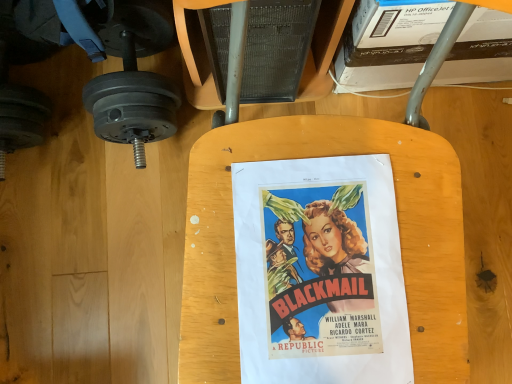
Question: Is vibrant paper poster at center next to matte black dumbbell at left?

Choices:
 (A) yes
 (B) no

Answer: (B)

Question: Considering the relative sizes of vibrant paper poster at center and matte black dumbbell at left in the image provided, is vibrant paper poster at center bigger than matte black dumbbell at left?

Choices:
 (A) yes
 (B) no

Answer: (B)

Question: From a real-world perspective, does vibrant paper poster at center stand above matte black dumbbell at left?

Choices:
 (A) yes
 (B) no

Answer: (A)

Question: Considering the relative sizes of vibrant paper poster at center and matte black dumbbell at left in the image provided, is vibrant paper poster at center thinner than matte black dumbbell at left?

Choices:
 (A) no
 (B) yes

Answer: (B)

Question: From the image's perspective, is vibrant paper poster at center over matte black dumbbell at left?

Choices:
 (A) no
 (B) yes

Answer: (A)

Question: Is vibrant paper poster at center positioned with its back to matte black dumbbell at left?

Choices:
 (A) no
 (B) yes

Answer: (A)

Question: Considering the relative sizes of matte black dumbbell at left and vibrant paper poster at center in the image provided, is matte black dumbbell at left taller than vibrant paper poster at center?

Choices:
 (A) no
 (B) yes

Answer: (B)

Question: Is the depth of matte black dumbbell at left greater than that of vibrant paper poster at center?

Choices:
 (A) no
 (B) yes

Answer: (B)

Question: Is matte black dumbbell at left to the left of vibrant paper poster at center from the viewer's perspective?

Choices:
 (A) no
 (B) yes

Answer: (B)

Question: Does matte black dumbbell at left have a lesser height compared to vibrant paper poster at center?

Choices:
 (A) yes
 (B) no

Answer: (B)

Question: From the image's perspective, is matte black dumbbell at left beneath vibrant paper poster at center?

Choices:
 (A) yes
 (B) no

Answer: (B)

Question: From a real-world perspective, does matte black dumbbell at left stand above vibrant paper poster at center?

Choices:
 (A) yes
 (B) no

Answer: (B)

Question: Is vibrant paper poster at center inside or outside of matte black dumbbell at left?

Choices:
 (A) inside
 (B) outside

Answer: (B)